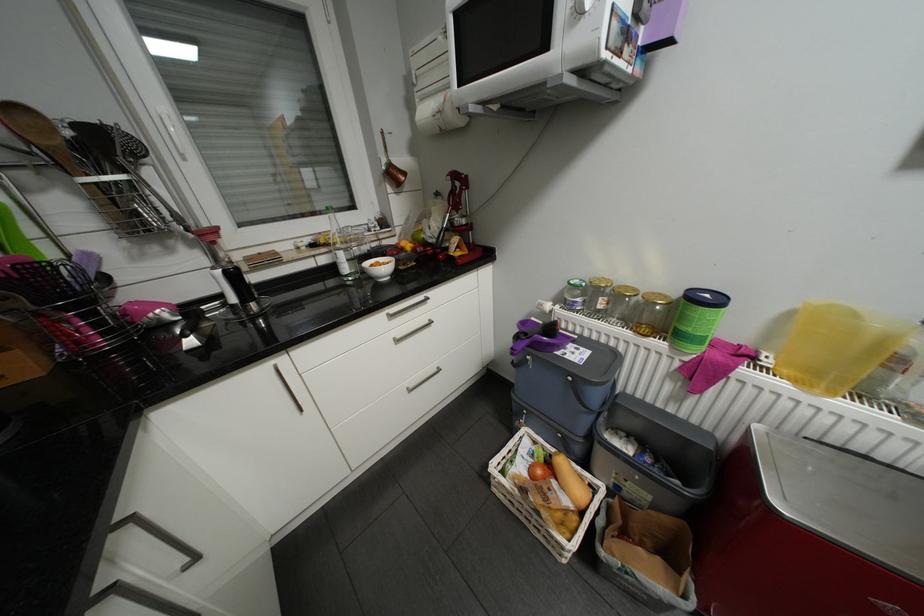
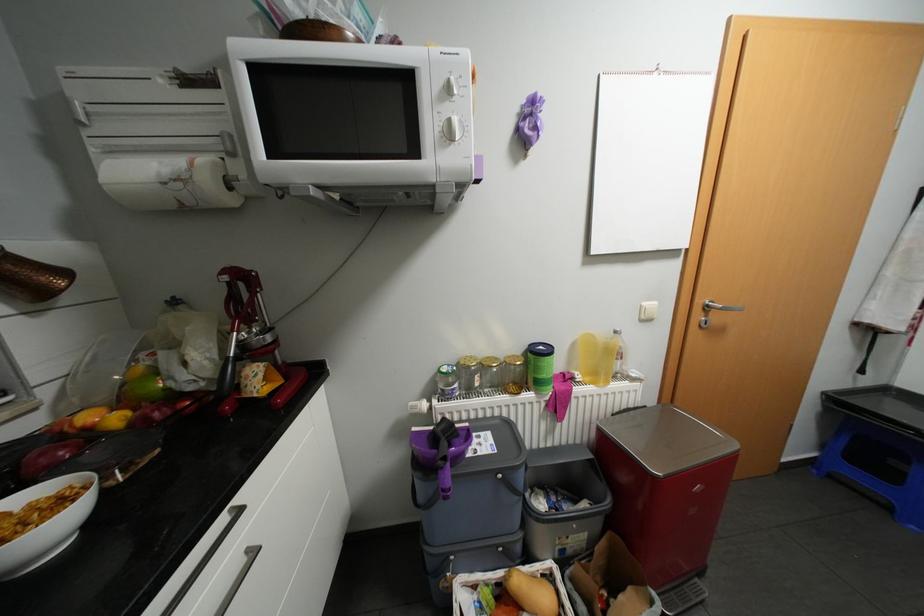
In the second image, find the point that corresponds to pixel 679 345 in the first image.

(544, 392)